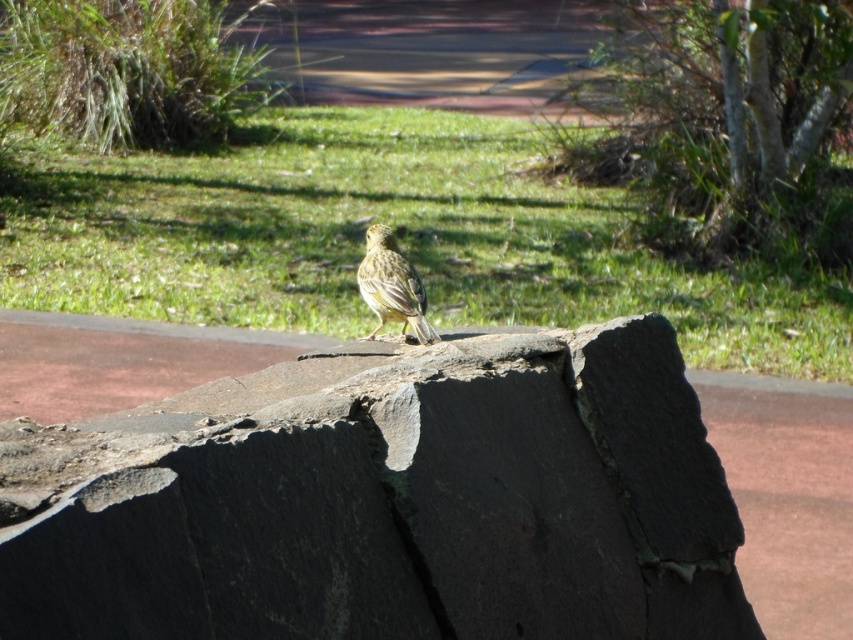
Does green grass at center have a greater width compared to yellow matte sparrow at center?

Correct, the width of green grass at center exceeds that of yellow matte sparrow at center.

Is green grass at center above yellow matte sparrow at center?

Indeed, green grass at center is positioned over yellow matte sparrow at center.

Is point (840, 362) positioned behind point (372, 296)?

Yes.

Locate an element on the screen. Image resolution: width=853 pixels, height=640 pixels. green grass at center is located at coordinates (396, 232).

Does dark gray stone boulder at center have a lesser height compared to yellow matte sparrow at center?

In fact, dark gray stone boulder at center may be taller than yellow matte sparrow at center.

Which is in front, point (22, 632) or point (418, 312)?

Point (22, 632) is more forward.

I want to click on dark gray stone boulder at center, so click(x=386, y=500).

You are a GUI agent. You are given a task and a screenshot of the screen. Output one action in this format:
    pyautogui.click(x=<x>, y=<y>)
    Task: Click on the dark gray stone boulder at center
    
    Given the screenshot: What is the action you would take?
    pyautogui.click(x=386, y=500)

Between dark gray stone boulder at center and green grass at center, which one is positioned higher?

green grass at center is above.

Between dark gray stone boulder at center and green grass at center, which one is positioned lower?

dark gray stone boulder at center is below.

You are a GUI agent. You are given a task and a screenshot of the screen. Output one action in this format:
    pyautogui.click(x=<x>, y=<y>)
    Task: Click on the dark gray stone boulder at center
    
    Given the screenshot: What is the action you would take?
    pyautogui.click(x=386, y=500)